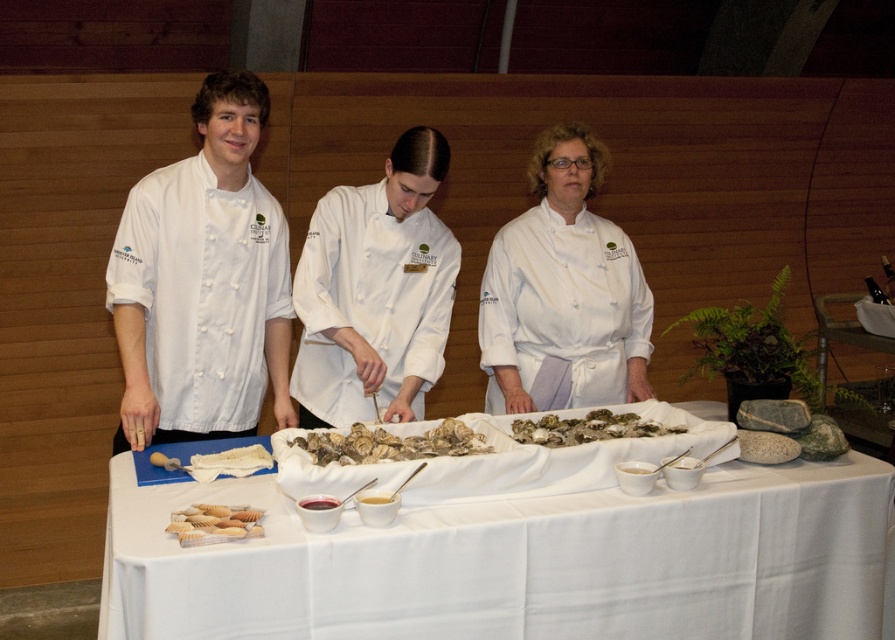
Question: Is white cloth at center to the right of white chef coat at center from the viewer's perspective?

Choices:
 (A) yes
 (B) no

Answer: (B)

Question: Does white matte uniform at left come behind white matte chef coat at center?

Choices:
 (A) yes
 (B) no

Answer: (B)

Question: Which object appears farthest from the camera in this image?

Choices:
 (A) white creamy sauce at center
 (B) white matte chef coat at center
 (C) white matte uniform at left
 (D) greenish-brown shell at center

Answer: (B)

Question: Can you confirm if white chef coat at center is positioned to the left of white oyster shells at center?

Choices:
 (A) no
 (B) yes

Answer: (A)

Question: Among these points, which one is farthest from the camera?

Choices:
 (A) (467, 433)
 (B) (661, 428)

Answer: (B)

Question: Based on their relative distances, which object is farther from the white oyster shells at center?

Choices:
 (A) greenish-brown shell at center
 (B) beige shell at center
 (C) white matte uniform at left
 (D) white creamy sauce at center

Answer: (C)